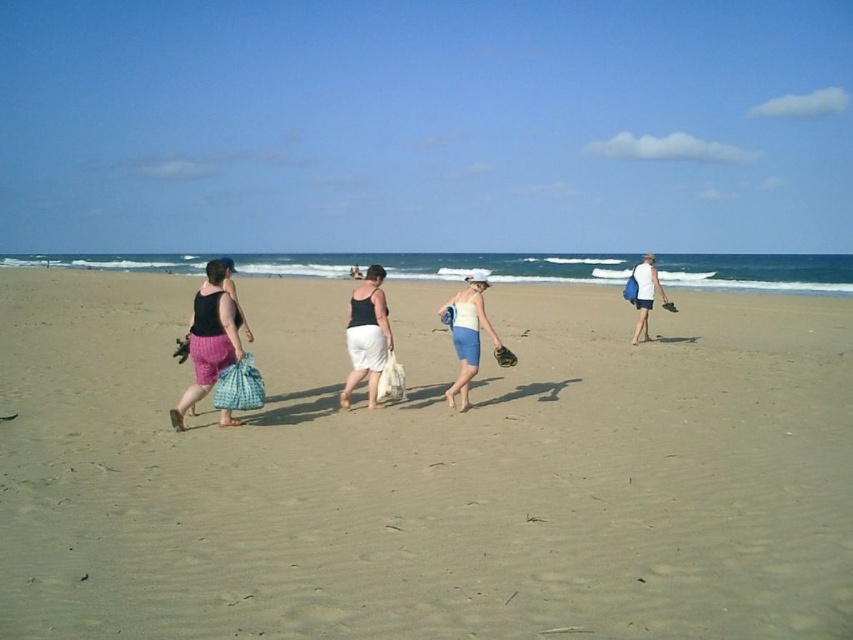
Does matte pink shorts at left appear over brown leather glove at lower left?

Yes.

Based on the photo, can you confirm if matte pink shorts at left is positioned to the left of brown leather glove at lower left?

Incorrect, matte pink shorts at left is not on the left side of brown leather glove at lower left.

Is point (213, 292) behind point (186, 336)?

No, (213, 292) is closer to viewer.

Find the location of a particular element. This screenshot has width=853, height=640. matte pink shorts at left is located at coordinates (209, 337).

Can you confirm if matte white tank top at center is wider than brown leather baseball glove at center-right?

No, matte white tank top at center is not wider than brown leather baseball glove at center-right.

Where is `matte white tank top at center`? This screenshot has height=640, width=853. matte white tank top at center is located at coordinates pyautogui.click(x=467, y=333).

Does matte black tank top at center have a smaller size compared to brown leather glove at center?

No, matte black tank top at center is not smaller than brown leather glove at center.

Locate an element on the screen. matte black tank top at center is located at coordinates (366, 336).

What are the coordinates of `matte black tank top at center` in the screenshot? It's located at (366, 336).